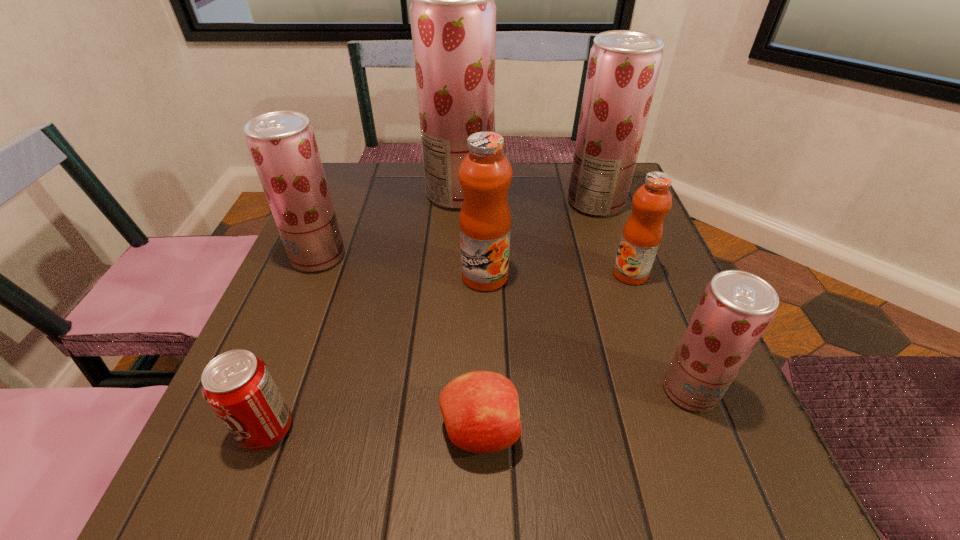
Locate an element on the screen. The width and height of the screenshot is (960, 540). the seventh tallest object is located at coordinates (238, 386).

Find the location of a particular element. The image size is (960, 540). apple is located at coordinates (480, 409).

Locate an element on the screen. red apple is located at coordinates (480, 409).

Image resolution: width=960 pixels, height=540 pixels. I want to click on free space located on the left of the tallest fruit juice, so click(392, 193).

Image resolution: width=960 pixels, height=540 pixels. Find the location of `vacant space located on the left of the seventh shortest object`. vacant space located on the left of the seventh shortest object is located at coordinates (503, 202).

Find the location of a particular element. This screenshot has width=960, height=540. free point located 0.070m on the right of the third farthest strawberry fruit juice is located at coordinates [377, 256].

The image size is (960, 540). In order to click on free space located on the front label of the left orange fruit juice in this screenshot , I will do `click(486, 341)`.

What are the coordinates of `vacant space positioned 0.180m on the front label of the right orange fruit juice` in the screenshot? It's located at (525, 274).

Locate an element on the screen. The width and height of the screenshot is (960, 540). blank space located on the front label of the right orange fruit juice is located at coordinates (516, 274).

Locate an element on the screen. This screenshot has width=960, height=540. free space located on the front label of the right orange fruit juice is located at coordinates [584, 274].